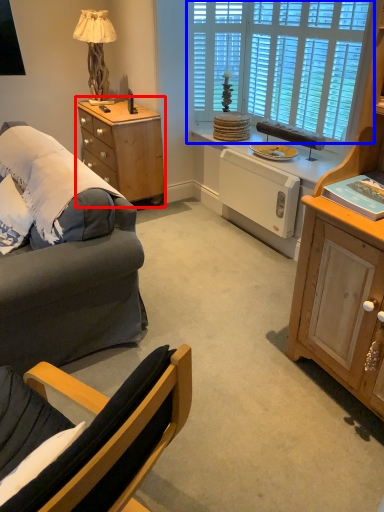
Question: Which object is further to the camera taking this photo, table (highlighted by a red box) or window (highlighted by a blue box)?

Choices:
 (A) table
 (B) window

Answer: (A)